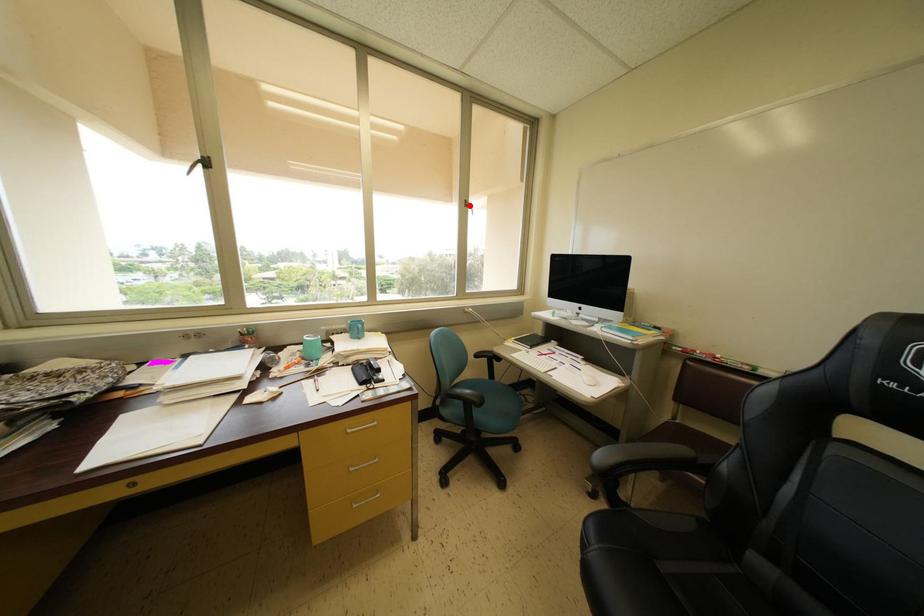
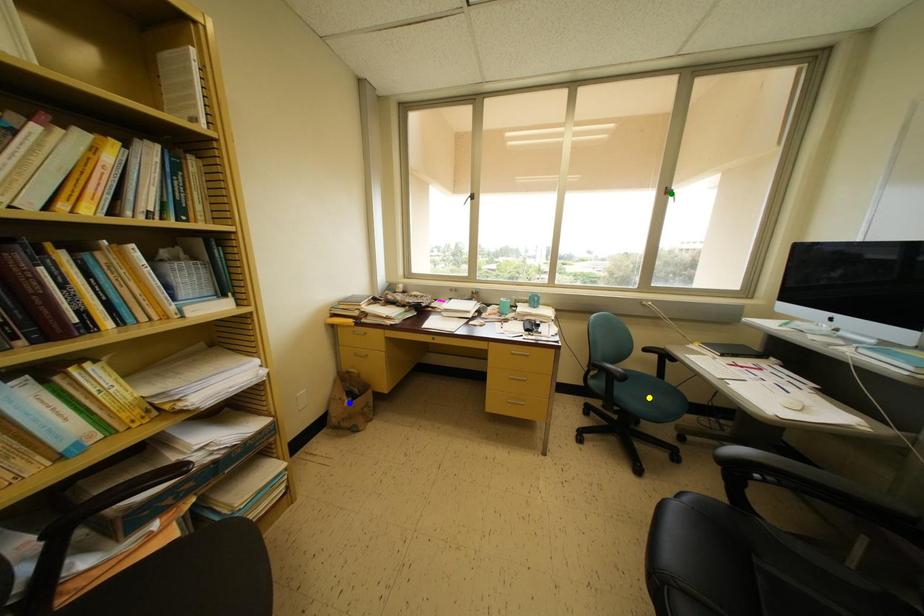
Question: I am providing you with two images of the same scene from different viewpoints. A red point is marked on the first image. You are given multiple points on the second image. Which point in image 2 is actually the same real-world point as the red point in image 1?

Choices:
 (A) green point
 (B) yellow point
 (C) blue point

Answer: (A)